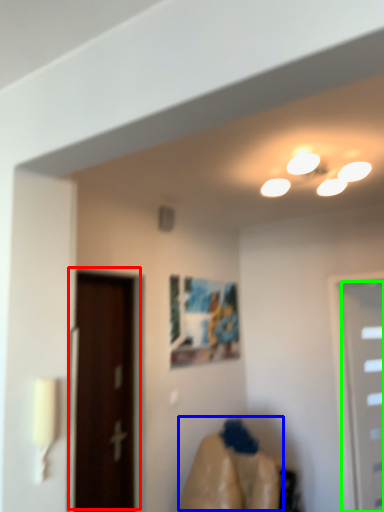
Question: Estimate the real-world distances between objects in this image. Which object is closer to door (highlighted by a red box), woman (highlighted by a blue box) or door (highlighted by a green box)?

Choices:
 (A) woman
 (B) door

Answer: (A)